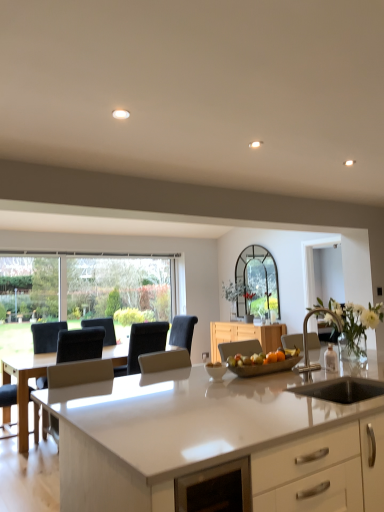
Question: Is black fabric armchair at center, the 2th armchair when ordered from left to right, aimed at metallic silver tray at center?

Choices:
 (A) no
 (B) yes

Answer: (A)

Question: Is black fabric armchair at center, the 3th armchair when ordered from front to back, smaller than metallic silver tray at center?

Choices:
 (A) no
 (B) yes

Answer: (A)

Question: Does black fabric armchair at center, which is the 1th armchair in back-to-front order, come behind metallic silver tray at center?

Choices:
 (A) no
 (B) yes

Answer: (B)

Question: Can you confirm if black fabric armchair at center, the 3th armchair when ordered from front to back, is shorter than metallic silver tray at center?

Choices:
 (A) no
 (B) yes

Answer: (A)

Question: Can you confirm if black fabric armchair at center, the 3th armchair when ordered from front to back, is wider than metallic silver tray at center?

Choices:
 (A) no
 (B) yes

Answer: (B)

Question: Is point (114, 373) positioned closer to the camera than point (79, 369)?

Choices:
 (A) farther
 (B) closer

Answer: (A)

Question: Is black fabric armchair at center, the 2th armchair when ordered from left to right, bigger or smaller than white leather armchair at left, the 2th armchair in the front-to-back sequence?

Choices:
 (A) big
 (B) small

Answer: (B)

Question: Considering their positions, is black fabric armchair at center, the 2th armchair when ordered from left to right, located in front of or behind white leather armchair at left, the 2th armchair in the front-to-back sequence?

Choices:
 (A) behind
 (B) front

Answer: (A)

Question: Is black fabric armchair at center, which is the 1th armchair in back-to-front order, to the left or to the right of white leather armchair at left, the 2th armchair in the front-to-back sequence, in the image?

Choices:
 (A) left
 (B) right

Answer: (B)

Question: Is white glossy countertop at center wider or thinner than metallic silver tray at center?

Choices:
 (A) wide
 (B) thin

Answer: (A)

Question: From the image's perspective, relative to metallic silver tray at center, is white glossy countertop at center above or below?

Choices:
 (A) below
 (B) above

Answer: (A)

Question: From a real-world perspective, relative to metallic silver tray at center, is white glossy countertop at center vertically above or below?

Choices:
 (A) below
 (B) above

Answer: (A)

Question: Is white glossy countertop at center inside the boundaries of metallic silver tray at center, or outside?

Choices:
 (A) outside
 (B) inside

Answer: (A)

Question: Is satin silver armchair at center, marked as the 3th armchair in a left-to-right arrangement, wider or thinner than metallic silver tray at center?

Choices:
 (A) thin
 (B) wide

Answer: (B)

Question: From a real-world perspective, is satin silver armchair at center, the first armchair viewed from the front, physically located above or below metallic silver tray at center?

Choices:
 (A) below
 (B) above

Answer: (B)